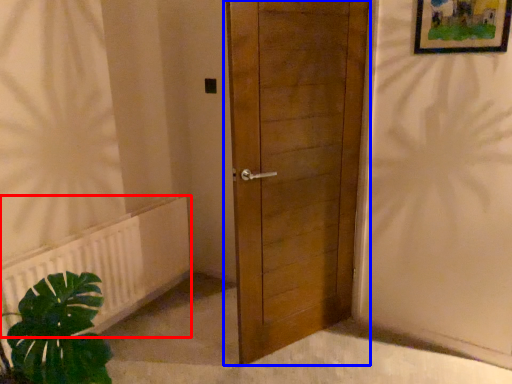
Question: Which of the following is the closest to the observer, radiator (highlighted by a red box) or door (highlighted by a blue box)?

Choices:
 (A) radiator
 (B) door

Answer: (B)